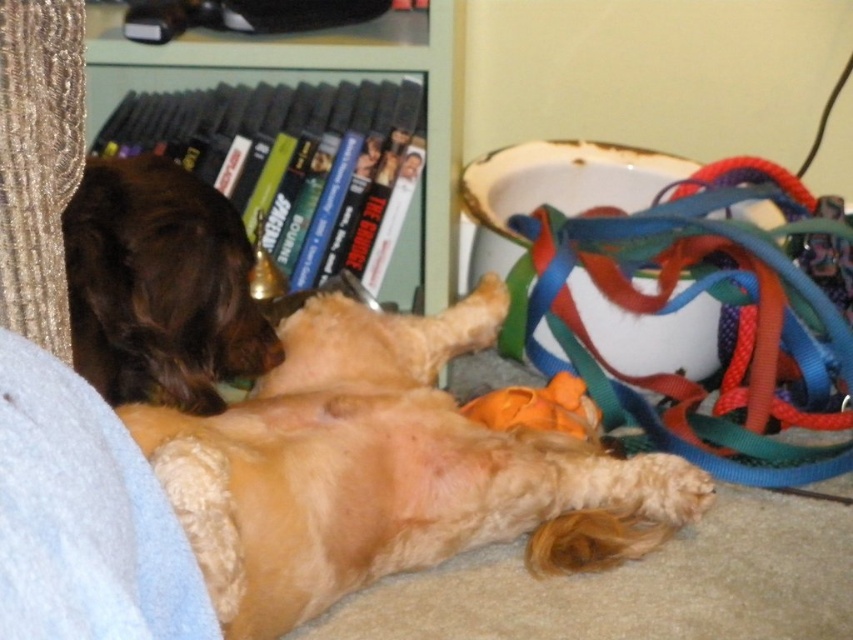
Is fuzzy golden dog at center taller than black plastic bookshelf at upper left?

Incorrect, fuzzy golden dog at center's height is not larger of black plastic bookshelf at upper left's.

Does fuzzy golden dog at center have a smaller size compared to black plastic bookshelf at upper left?

Actually, fuzzy golden dog at center might be larger than black plastic bookshelf at upper left.

Which is behind, point (138, 422) or point (398, 38)?

The point (398, 38) is more distant.

The height and width of the screenshot is (640, 853). I want to click on fuzzy golden dog at center, so click(386, 468).

Which is more to the left, fuzzy golden dog at center or brown fuzzy dog at upper left?

Positioned to the left is brown fuzzy dog at upper left.

Which of these two, fuzzy golden dog at center or brown fuzzy dog at upper left, stands taller?

With more height is fuzzy golden dog at center.

The image size is (853, 640). What do you see at coordinates (386, 468) in the screenshot? I see `fuzzy golden dog at center` at bounding box center [386, 468].

Find the location of `fuzzy golden dog at center`. fuzzy golden dog at center is located at coordinates (386, 468).

Is point (158, 186) positioned before point (445, 88)?

Yes, it is in front of point (445, 88).

Who is higher up, brown fuzzy dog at upper left or black plastic bookshelf at upper left?

black plastic bookshelf at upper left is higher up.

Between point (163, 346) and point (460, 19), which one is positioned in front?

Point (163, 346) is in front.

The width and height of the screenshot is (853, 640). I want to click on brown fuzzy dog at upper left, so click(160, 285).